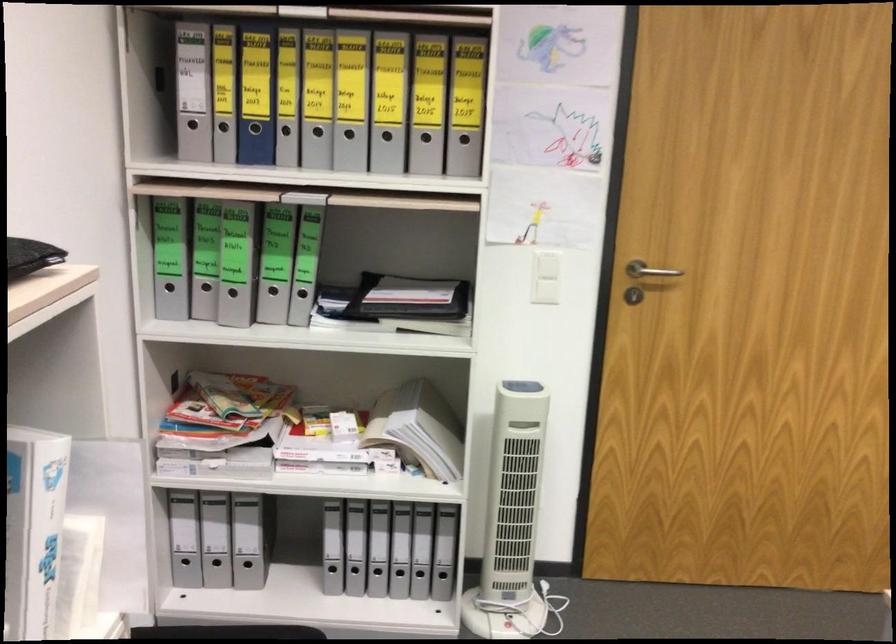
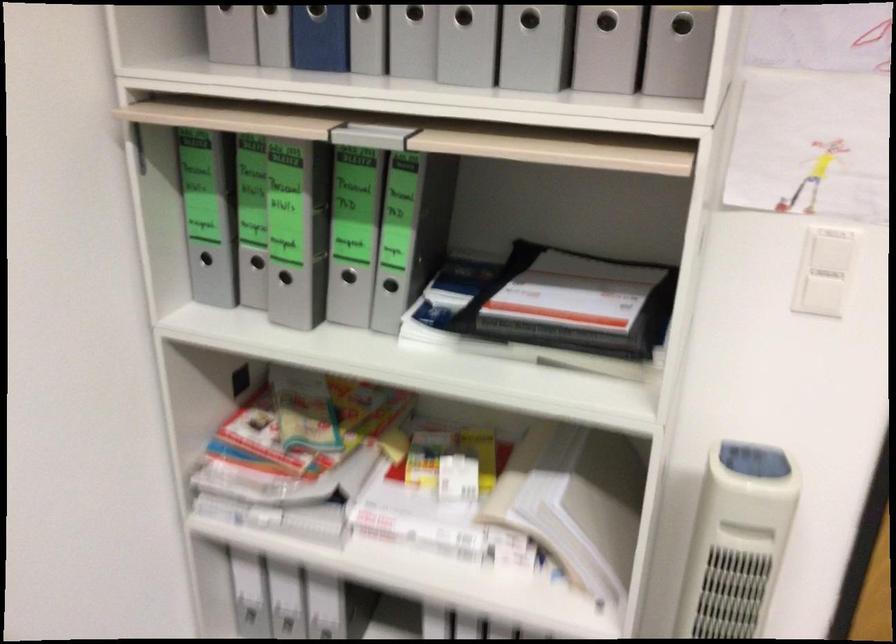
In the second image, find the point that corresponds to the point at 556,292 in the first image.

(823, 295)